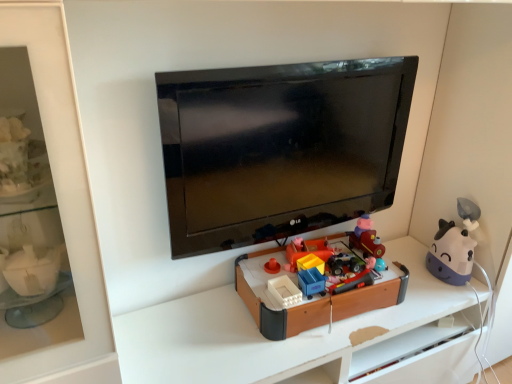
At what (x,y) coordinates should I click in order to perform the action: click on unoccupied space behind rubberized plastic toy car at center, which is the third toy in right-to-left order. Please return your answer as a coordinate pair (x, y). The image size is (512, 384). Looking at the image, I should click on pos(337,248).